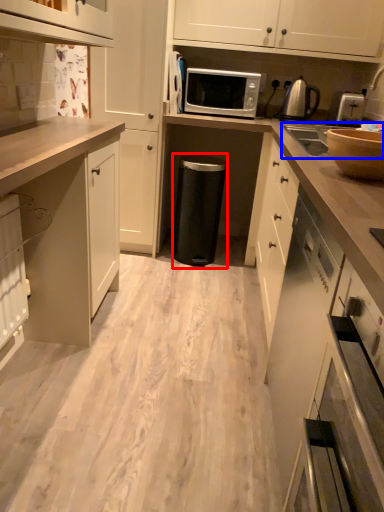
Question: Among these objects, which one is farthest to the camera, appliance (highlighted by a red box) or sink (highlighted by a blue box)?

Choices:
 (A) appliance
 (B) sink

Answer: (A)